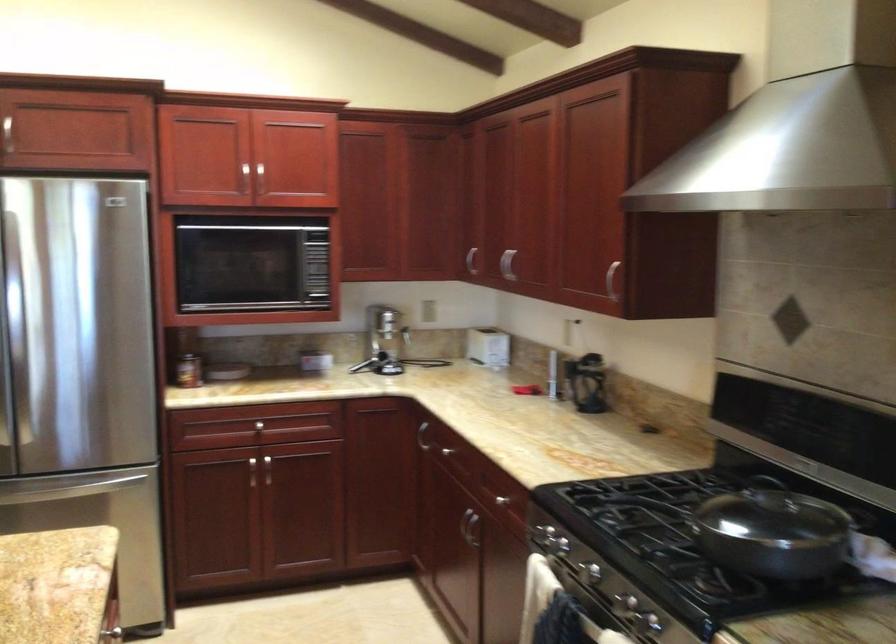
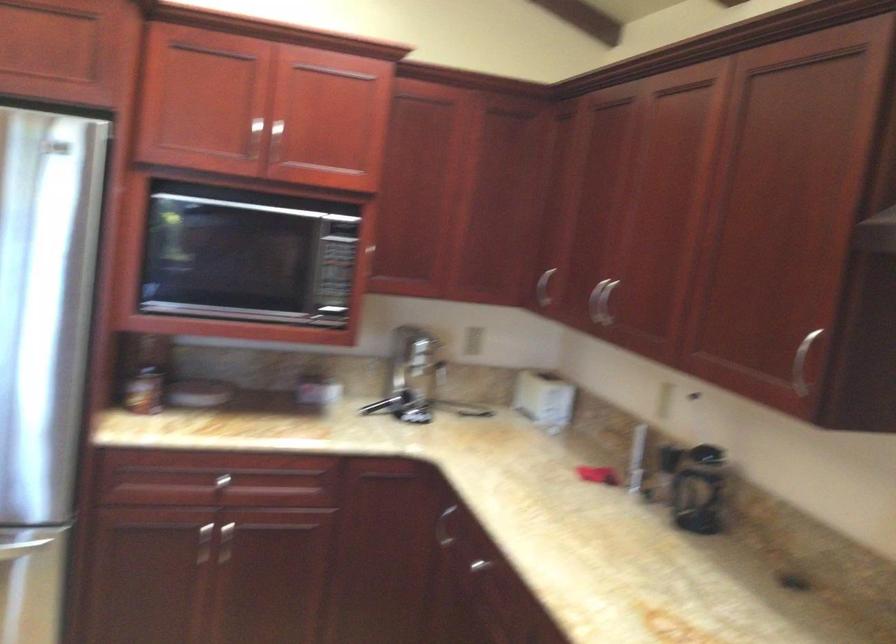
Locate, in the second image, the point that corresponds to (263,474) in the first image.

(222, 543)